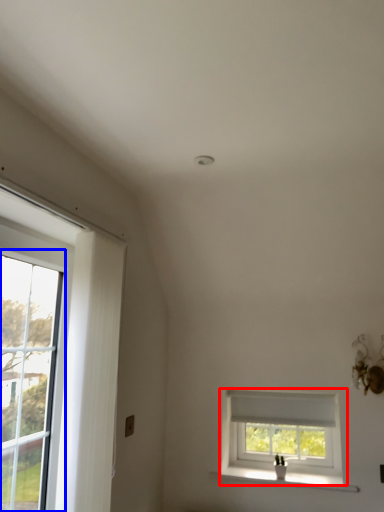
Question: Which of the following is the closest to the observer, window (highlighted by a red box) or glass door (highlighted by a blue box)?

Choices:
 (A) window
 (B) glass door

Answer: (B)